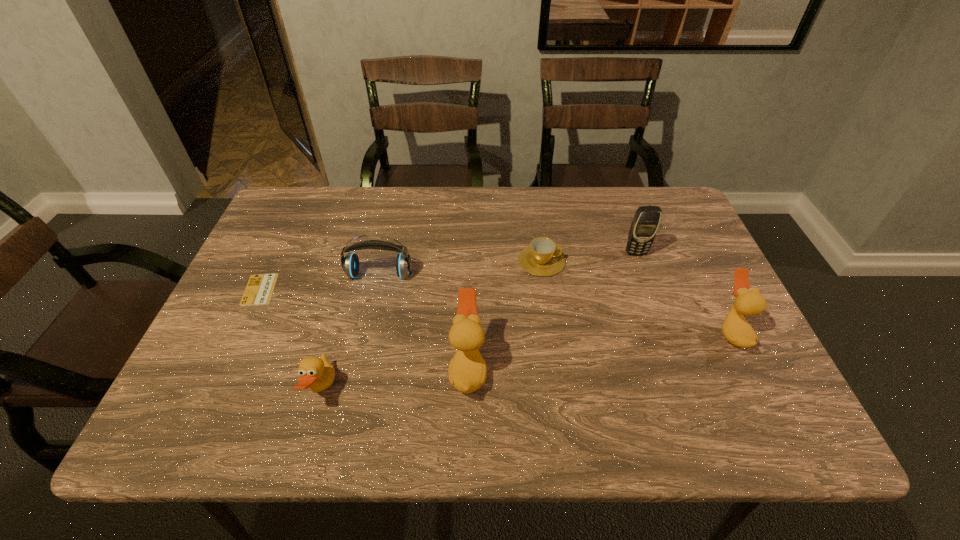
This screenshot has width=960, height=540. I want to click on the fifth tallest object, so click(x=316, y=373).

Find the location of a particular element. the leftmost duck is located at coordinates (316, 373).

Locate an element on the screen. the fourth object from left to right is located at coordinates (467, 371).

Where is `the tallest duck`? the tallest duck is located at coordinates (467, 371).

Where is `the rightmost duck`? the rightmost duck is located at coordinates (749, 302).

Locate an element on the screen. This screenshot has width=960, height=540. the rightmost object is located at coordinates (749, 302).

Find the location of a particular element. identity card is located at coordinates (259, 290).

Where is `the leftmost object`? the leftmost object is located at coordinates (259, 290).

This screenshot has height=540, width=960. I want to click on cellular telephone, so click(x=644, y=226).

The width and height of the screenshot is (960, 540). Find the location of `headset`. headset is located at coordinates (350, 264).